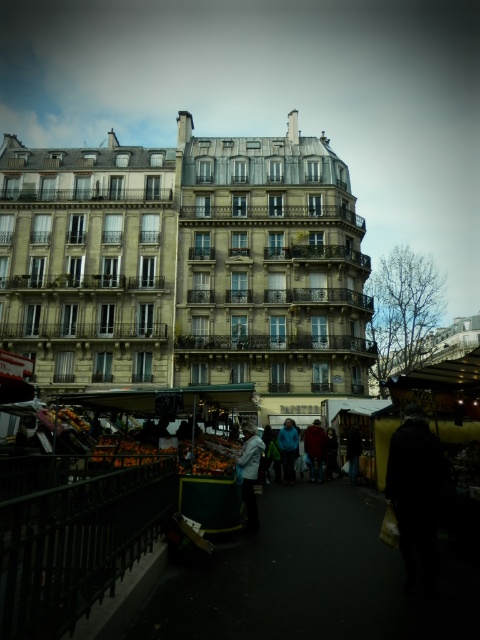
Question: Among these objects, which one is farthest from the camera?

Choices:
 (A) dark gray jacket at center
 (B) light gray fabric jacket at center
 (C) blue fabric jacket at center
 (D) black matte coat at lower right

Answer: (C)

Question: Which point appears farthest from the camera in this image?

Choices:
 (A) (415, 406)
 (B) (351, 426)
 (C) (289, 435)
 (D) (241, 490)

Answer: (B)

Question: Estimate the real-world distances between objects in this image. Which object is closer to the black matte coat at lower right?

Choices:
 (A) dark blue jacket at center
 (B) blue fabric jacket at center

Answer: (A)

Question: Is black matte coat at lower right positioned behind dark blue jacket at center?

Choices:
 (A) yes
 (B) no

Answer: (B)

Question: Considering the relative positions of black matte coat at lower right and blue fabric jacket at center in the image provided, where is black matte coat at lower right located with respect to blue fabric jacket at center?

Choices:
 (A) below
 (B) above

Answer: (B)

Question: Is black matte coat at lower right wider than blue fabric jacket at center?

Choices:
 (A) no
 (B) yes

Answer: (B)